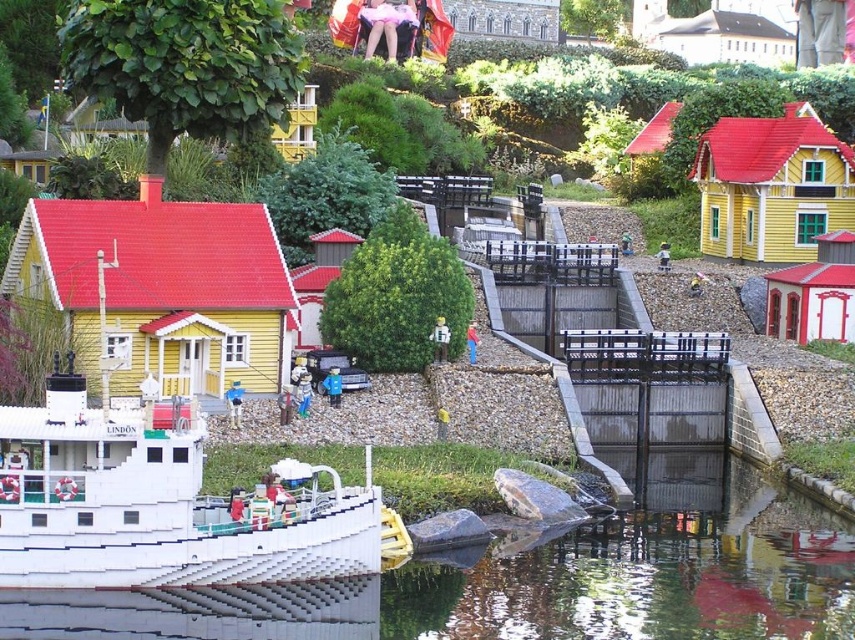
You are a visitor at the miniature village scene. You notice the white plastic boat at center and the smooth plastic toy at center. Which object is positioned lower in the scene?

The white plastic boat at center is positioned lower than the smooth plastic toy at center in the scene.

You are a child visiting the miniature village scene at a museum. You see a smooth plastic toy at center and a blue plastic figure at center. Which one is bigger?

The smooth plastic toy at center is larger in size compared to the blue plastic figure at center.

You are navigating a tiny remote control boat through this miniature village scene. Your goal is to reach the point marked as point (192, 467). You start from the white boat docked along the canal. Which direction should you steer your boat to reach the target point without passing through point (236, 385)?

Since point (192, 467) is in front of point (236, 385), you should steer your boat towards the direction of point (192, 467), ensuring not to go past point (236, 385). This way, you can reach the target point without passing through the other point.